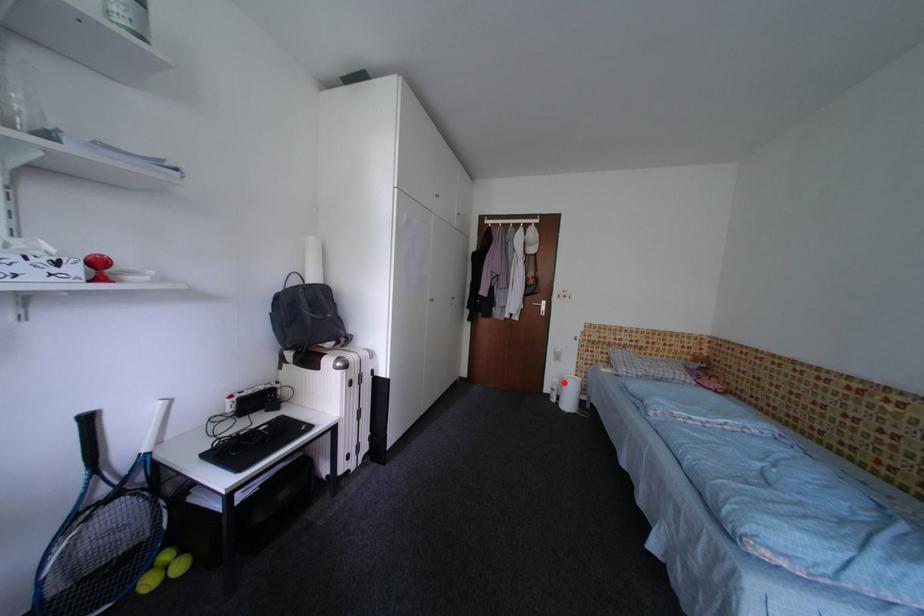
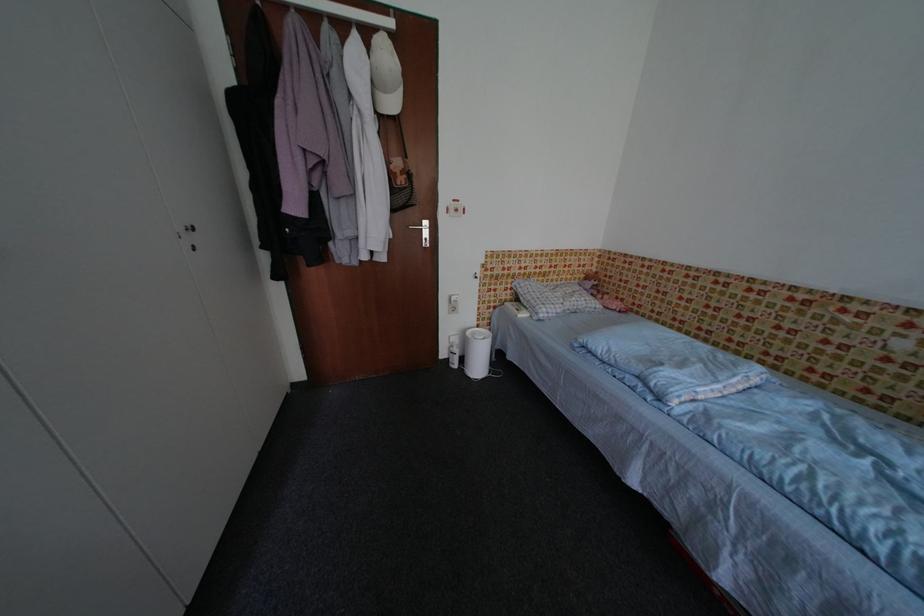
Question: I am providing you with two images of the same scene from different viewpoints. A red point is shown in image1. For the corresponding object point in image2, is it positioned nearer or farther from the camera?

Choices:
 (A) Nearer
 (B) Farther

Answer: (A)